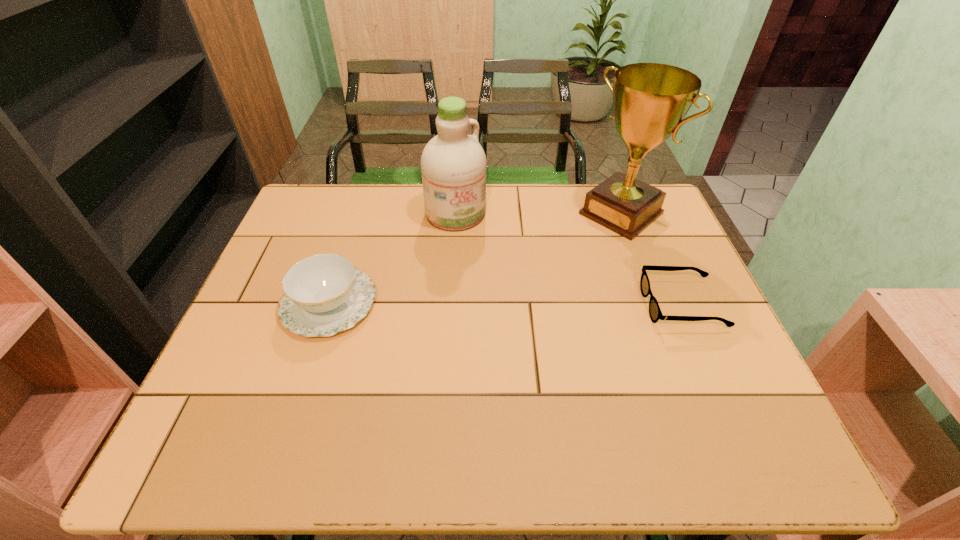
This screenshot has width=960, height=540. What are the coordinates of `award present at the right edge` in the screenshot? It's located at (650, 100).

Where is `object present at the far right corner`? The height and width of the screenshot is (540, 960). object present at the far right corner is located at coordinates (650, 100).

I want to click on free space at the far edge, so click(x=358, y=224).

Identify the location of vacant space at the near edge of the desktop. (611, 406).

This screenshot has height=540, width=960. I want to click on vacant space at the far left corner, so click(319, 189).

At what (x,y) coordinates should I click in order to perform the action: click on free space between the shortest object and the chinaware. Please return your answer as a coordinate pair (x, y). Looking at the image, I should click on (505, 305).

Find the location of `vacant space that is in between the cleansing agent and the leftmost object`. vacant space that is in between the cleansing agent and the leftmost object is located at coordinates [x=393, y=259].

This screenshot has height=540, width=960. I want to click on vacant point located between the cleansing agent and the shortest object, so coord(568,259).

You are a GUI agent. You are given a task and a screenshot of the screen. Output one action in this format:
    pyautogui.click(x=<x>, y=<y>)
    Task: Click on the free space that is in between the second shortest object and the second tallest object
    
    Given the screenshot: What is the action you would take?
    pyautogui.click(x=393, y=259)

Identify the location of free space between the third tallest object and the third shortest object. (393, 259).